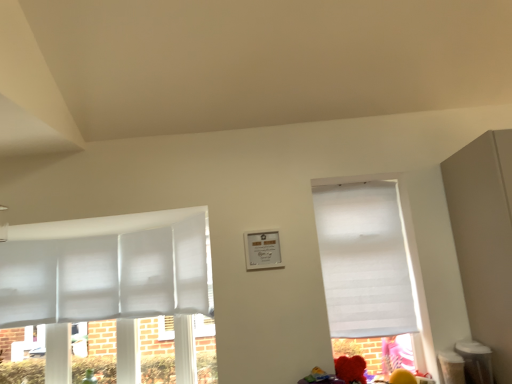
Measure the distance between fluffy red teddy bear at lower right and camera.

The distance of fluffy red teddy bear at lower right from camera is 2.38 meters.

Where is `fluffy red teddy bear at lower right`? The width and height of the screenshot is (512, 384). fluffy red teddy bear at lower right is located at coordinates (350, 369).

Describe the element at coordinates (350, 369) in the screenshot. Image resolution: width=512 pixels, height=384 pixels. I see `fluffy red teddy bear at lower right` at that location.

The height and width of the screenshot is (384, 512). What do you see at coordinates (426, 258) in the screenshot?
I see `white fabric window at right` at bounding box center [426, 258].

What is the approximate height of white fabric window at right?

It is 1.29 meters.

This screenshot has width=512, height=384. What are the coordinates of `white fabric window at right` in the screenshot? It's located at (426, 258).

Identify the location of fluffy red teddy bear at lower right. Image resolution: width=512 pixels, height=384 pixels. (350, 369).

Considering the positions of objects white fabric window at right and fluffy red teddy bear at lower right in the image provided, who is more to the left, white fabric window at right or fluffy red teddy bear at lower right?

fluffy red teddy bear at lower right.

Considering the positions of objects white fabric window at right and fluffy red teddy bear at lower right in the image provided, who is behind, white fabric window at right or fluffy red teddy bear at lower right?

white fabric window at right is more distant.

Which is closer, (350, 176) or (350, 361)?

Point (350, 176) appears to be farther away from the viewer than point (350, 361).

From the picture: From the image's perspective, is white fabric window at right under fluffy red teddy bear at lower right?

No, from the image's perspective, white fabric window at right is not beneath fluffy red teddy bear at lower right.

From the picture: From a real-world perspective, is white fabric window at right positioned above or below fluffy red teddy bear at lower right?

Clearly, from a real-world perspective, white fabric window at right is above fluffy red teddy bear at lower right.

Which object is wider, white fabric window at right or fluffy red teddy bear at lower right?

fluffy red teddy bear at lower right.

Considering the relative sizes of white fabric window at right and fluffy red teddy bear at lower right in the image provided, is white fabric window at right shorter than fluffy red teddy bear at lower right?

No.

Between white fabric window at right and fluffy red teddy bear at lower right, which one has smaller size?

Smaller between the two is fluffy red teddy bear at lower right.

Can we say white fabric window at right lies outside fluffy red teddy bear at lower right?

Yes.

Is white fabric window at right placed right next to fluffy red teddy bear at lower right?

They are not placed beside each other.

Is white fabric window at right facing away from fluffy red teddy bear at lower right?

No, fluffy red teddy bear at lower right is not at the back of white fabric window at right.

How far apart are white fabric window at right and fluffy red teddy bear at lower right?

They are 26.88 inches apart.

The width and height of the screenshot is (512, 384). Identify the location of flower on the left of white fabric window at right. (350, 369).

Is fluffy red teddy bear at lower right to the right of white fabric window at right from the viewer's perspective?

No.

Consider the image. Which object is closer to the camera, fluffy red teddy bear at lower right or white fabric window at right?

fluffy red teddy bear at lower right is in front.

Considering the positions of point (353, 370) and point (414, 191), is point (353, 370) closer or farther from the camera than point (414, 191)?

Point (353, 370) appears to be closer to the viewer than point (414, 191).

From the image's perspective, is fluffy red teddy bear at lower right above or below white fabric window at right?

fluffy red teddy bear at lower right is situated lower than white fabric window at right in the image.

From a real-world perspective, is fluffy red teddy bear at lower right positioned above or below white fabric window at right?

fluffy red teddy bear at lower right is below white fabric window at right.

Considering the sizes of fluffy red teddy bear at lower right and white fabric window at right in the image, is fluffy red teddy bear at lower right wider or thinner than white fabric window at right?

fluffy red teddy bear at lower right is wider than white fabric window at right.

In terms of height, does fluffy red teddy bear at lower right look taller or shorter compared to white fabric window at right?

In the image, fluffy red teddy bear at lower right appears to be shorter than white fabric window at right.

Which of these two, fluffy red teddy bear at lower right or white fabric window at right, is bigger?

Bigger between the two is white fabric window at right.

Is white fabric window at right located within fluffy red teddy bear at lower right?

No, fluffy red teddy bear at lower right does not contain white fabric window at right.

Looking at this image, is fluffy red teddy bear at lower right far from white fabric window at right?

Actually, fluffy red teddy bear at lower right and white fabric window at right are a little close together.

Is white fabric window at right at the back of fluffy red teddy bear at lower right?

Yes.

How distant is fluffy red teddy bear at lower right from white fabric window at right?

fluffy red teddy bear at lower right is 26.88 inches away from white fabric window at right.

The height and width of the screenshot is (384, 512). There is a fluffy red teddy bear at lower right. In order to click on window above it (from a real-world perspective) in this screenshot , I will do pyautogui.click(x=426, y=258).

This screenshot has height=384, width=512. I want to click on window above the fluffy red teddy bear at lower right (from a real-world perspective), so click(426, 258).

Where is `flower in front of the white fabric window at right`? Image resolution: width=512 pixels, height=384 pixels. flower in front of the white fabric window at right is located at coordinates (350, 369).